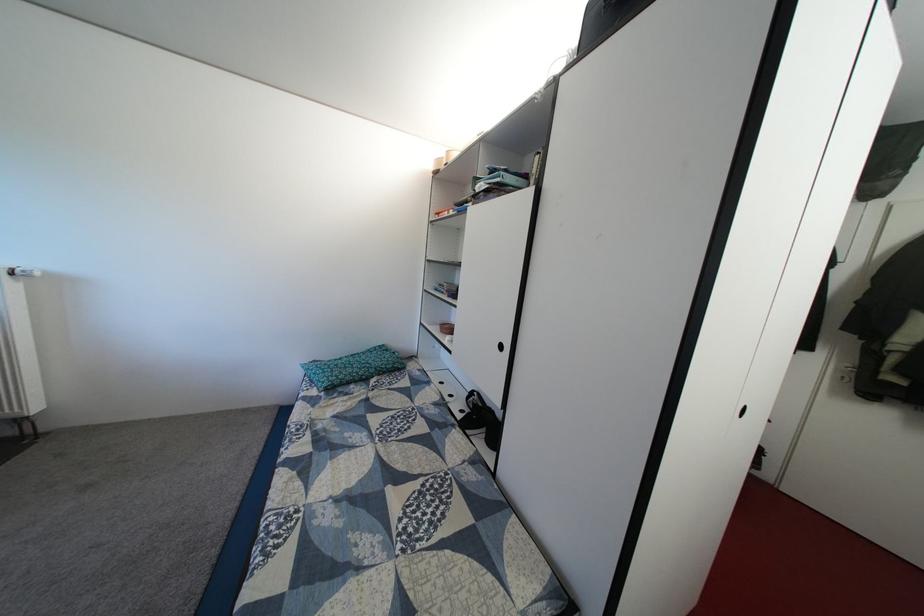
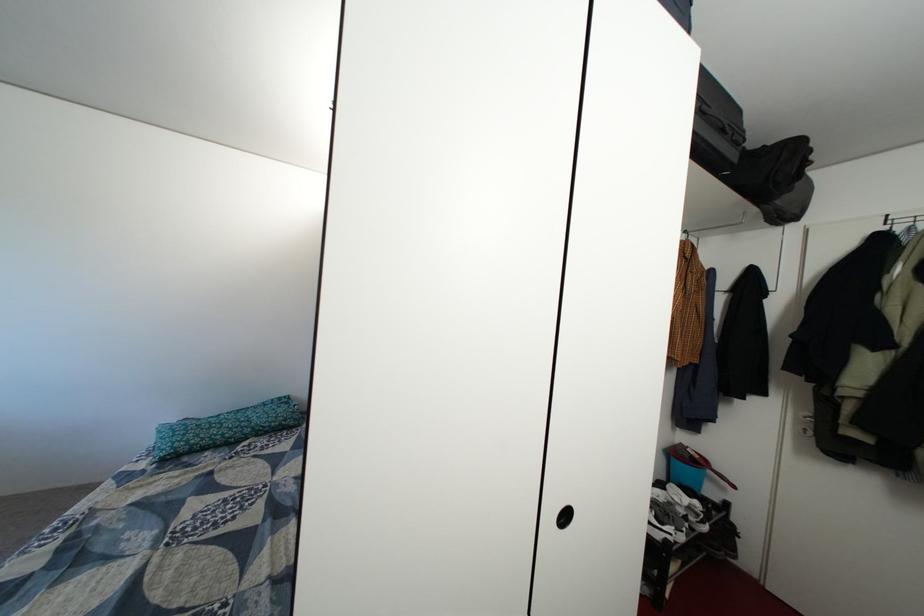
Question: Based on the continuous images, in which direction is the camera rotating? Reply with the corresponding letter.

Choices:
 (A) Left
 (B) Right
 (C) Up
 (D) Down

Answer: (C)